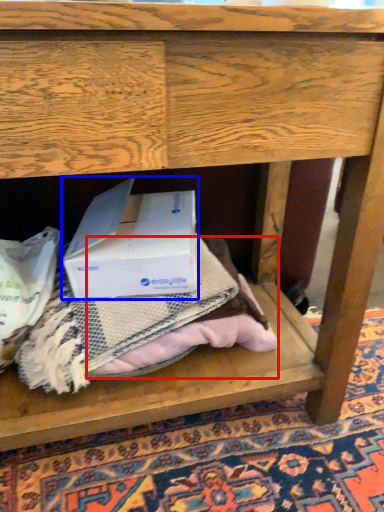
Question: Which object is further to the camera taking this photo, clothing (highlighted by a red box) or box (highlighted by a blue box)?

Choices:
 (A) clothing
 (B) box

Answer: (A)